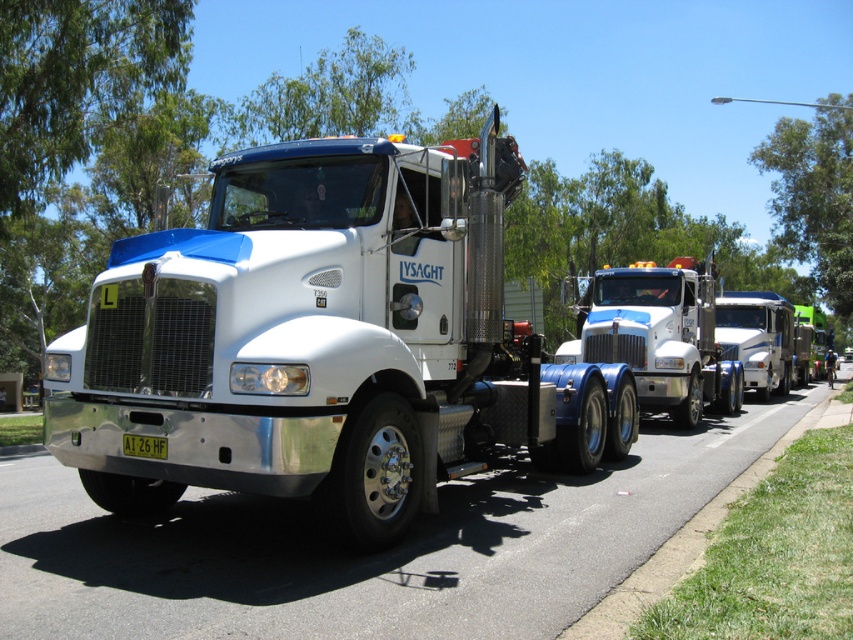
Question: Which point is farther to the camera?

Choices:
 (A) (701, 336)
 (B) (589, 624)
 (C) (341, 294)
 (D) (718, 339)

Answer: (D)

Question: Does white glossy trailer truck at center appear on the right side of white glossy truck at center?

Choices:
 (A) yes
 (B) no

Answer: (B)

Question: Which object is the farthest from the grassy sidewalk at lower right?

Choices:
 (A) white glossy trailer truck at center
 (B) white metallic truck at center

Answer: (B)

Question: Where is white metallic truck at center located in relation to white glossy truck at center in the image?

Choices:
 (A) left
 (B) right

Answer: (A)

Question: Can you confirm if white metallic truck at center is positioned to the right of white glossy truck at center?

Choices:
 (A) no
 (B) yes

Answer: (A)

Question: Estimate the real-world distances between objects in this image. Which object is closer to the white glossy trailer truck at center?

Choices:
 (A) white metallic truck at center
 (B) grassy sidewalk at lower right

Answer: (B)